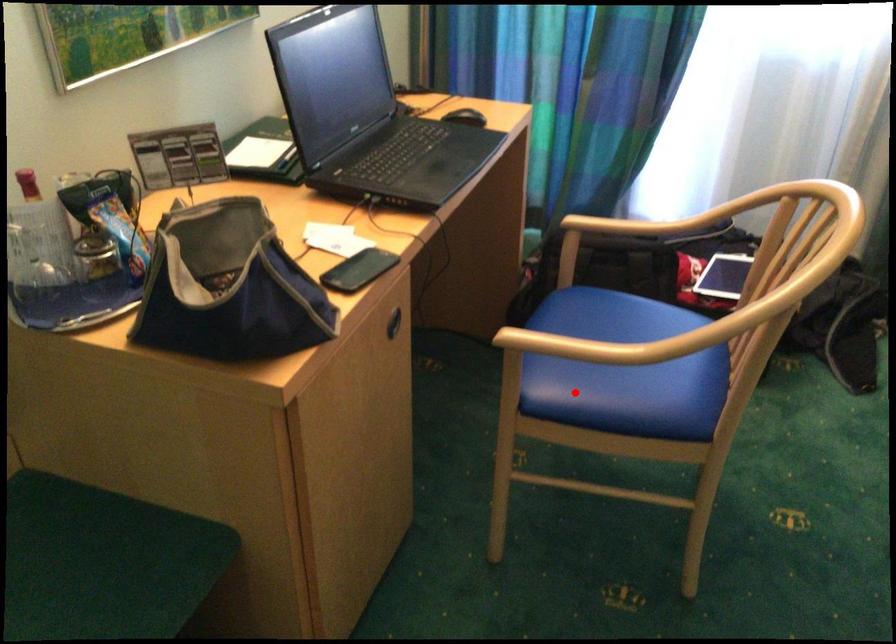
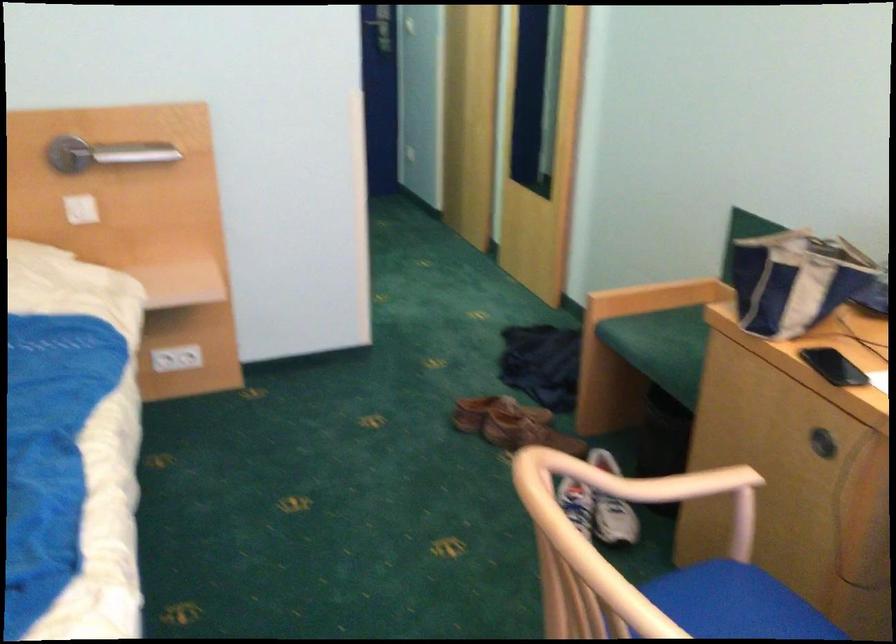
In the second image, find the point that corresponds to the highlighted location in the first image.

(711, 590)